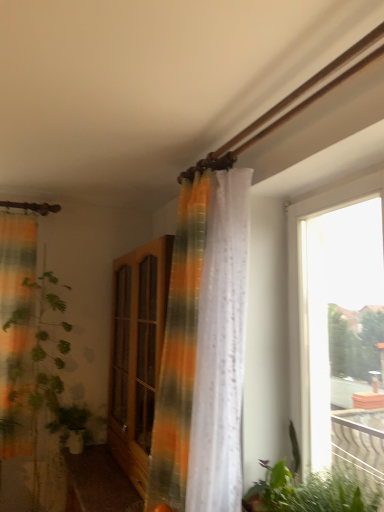
You are a GUI agent. You are given a task and a screenshot of the screen. Output one action in this format:
    pyautogui.click(x=<x>, y=<y>)
    Task: Click on the free space above transparent glass window at right (from a real-world perspective)
    
    Given the screenshot: What is the action you would take?
    pyautogui.click(x=341, y=183)